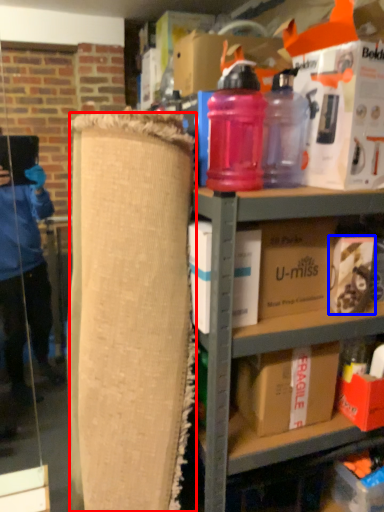
Question: Which object is closer to the camera taking this photo, plywood (highlighted by a red box) or box (highlighted by a blue box)?

Choices:
 (A) plywood
 (B) box

Answer: (A)